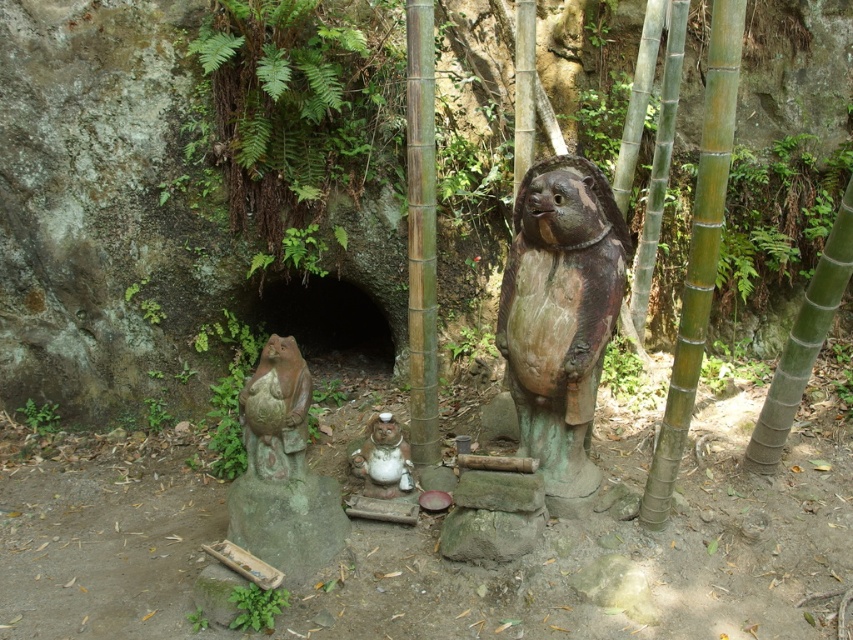
Question: Is rustic stone statue at lower left above white glossy statue at center?

Choices:
 (A) yes
 (B) no

Answer: (A)

Question: Which object is positioned closest to the white glossy statue at center?

Choices:
 (A) rustic stone statue at lower left
 (B) rustic wood bear at center

Answer: (A)

Question: Does rustic wood bear at center come in front of rustic stone statue at lower left?

Choices:
 (A) yes
 (B) no

Answer: (A)

Question: From the image, what is the correct spatial relationship of rustic stone statue at lower left in relation to white glossy statue at center?

Choices:
 (A) left
 (B) right

Answer: (A)

Question: Which point is closer to the camera?

Choices:
 (A) rustic stone statue at lower left
 (B) rustic wood bear at center

Answer: (B)

Question: Which is nearer to the rustic wood bear at center?

Choices:
 (A) white glossy statue at center
 (B) rustic stone statue at lower left

Answer: (A)